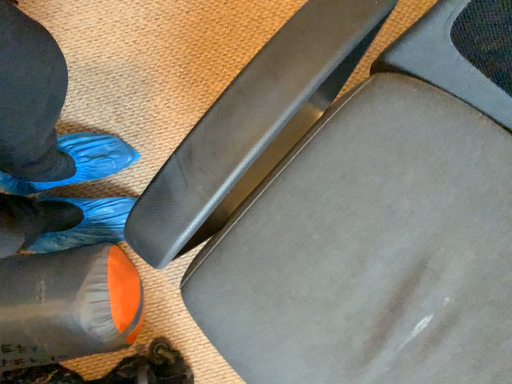
Describe the element at coordinates (67, 305) in the screenshot. I see `orange fabric shoe at lower left` at that location.

Find the location of a particular element. The width and height of the screenshot is (512, 384). orange fabric shoe at lower left is located at coordinates (67, 305).

Identify the location of orange fabric shoe at lower left. (67, 305).